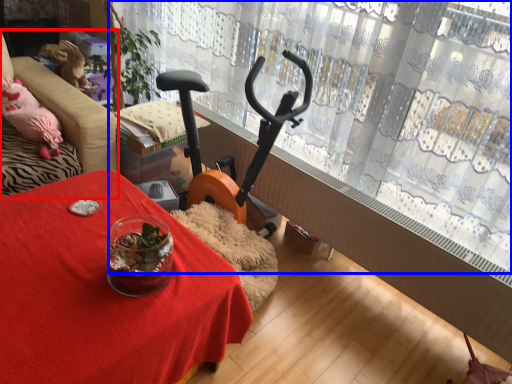
Question: Among these objects, which one is farthest to the camera, furniture (highlighted by a red box) or curtain (highlighted by a blue box)?

Choices:
 (A) furniture
 (B) curtain

Answer: (A)